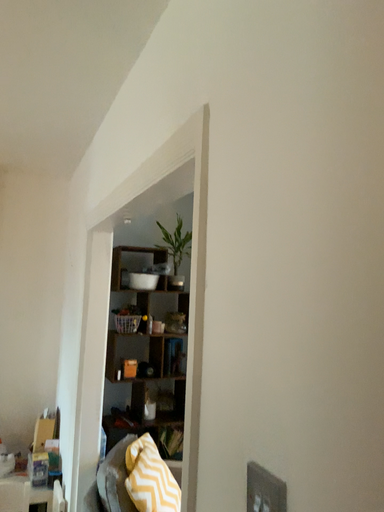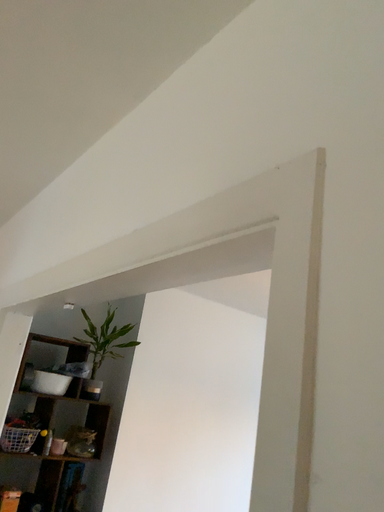
Question: How did the camera likely rotate when shooting the video?

Choices:
 (A) rotated upward
 (B) rotated downward

Answer: (A)